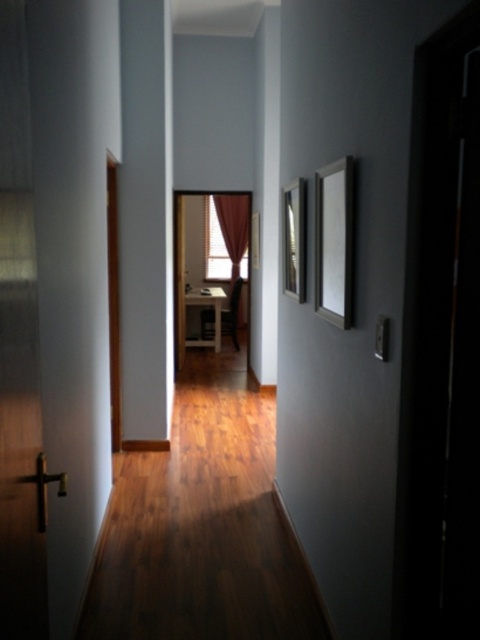
Is black glossy door at right below matte white curtain at center?

Indeed, black glossy door at right is positioned under matte white curtain at center.

Is point (429, 136) farther from viewer compared to point (208, 269)?

No.

Identify the location of black glossy door at right. The image size is (480, 640). (441, 346).

This screenshot has width=480, height=640. Identify the location of black glossy door at right. (441, 346).